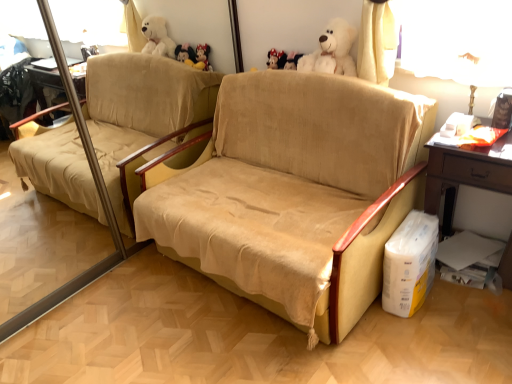
Question: From a real-world perspective, is beige suede couch at center on top of metallic gold table lamp at upper right?

Choices:
 (A) yes
 (B) no

Answer: (B)

Question: Is beige suede couch at center far away from metallic gold table lamp at upper right?

Choices:
 (A) no
 (B) yes

Answer: (A)

Question: Does beige suede couch at center have a greater width compared to metallic gold table lamp at upper right?

Choices:
 (A) no
 (B) yes

Answer: (B)

Question: Is beige suede couch at center behind metallic gold table lamp at upper right?

Choices:
 (A) yes
 (B) no

Answer: (B)

Question: Is beige suede couch at center completely or partially outside of metallic gold table lamp at upper right?

Choices:
 (A) no
 (B) yes

Answer: (B)

Question: In terms of width, does beige suede couch at center look wider or thinner when compared to white cardboard box at lower right?

Choices:
 (A) wide
 (B) thin

Answer: (A)

Question: Would you say beige suede couch at center is to the left or to the right of white cardboard box at lower right in the picture?

Choices:
 (A) right
 (B) left

Answer: (B)

Question: Looking at the image, does beige suede couch at center seem bigger or smaller compared to white cardboard box at lower right?

Choices:
 (A) small
 (B) big

Answer: (B)

Question: From the image's perspective, relative to white cardboard box at lower right, is beige suede couch at center above or below?

Choices:
 (A) below
 (B) above

Answer: (B)

Question: In the image, is fluffy white teddy bear at upper center on the left side or the right side of beige suede couch at center?

Choices:
 (A) left
 (B) right

Answer: (B)

Question: Is fluffy white teddy bear at upper center bigger or smaller than beige suede couch at center?

Choices:
 (A) big
 (B) small

Answer: (B)

Question: Considering the positions of fluffy white teddy bear at upper center and beige suede couch at center in the image, is fluffy white teddy bear at upper center wider or thinner than beige suede couch at center?

Choices:
 (A) wide
 (B) thin

Answer: (B)

Question: From a real-world perspective, is fluffy white teddy bear at upper center above or below beige suede couch at center?

Choices:
 (A) below
 (B) above

Answer: (B)

Question: From a real-world perspective, is wooden table at right positioned above or below white cardboard box at lower right?

Choices:
 (A) below
 (B) above

Answer: (B)

Question: Is wooden table at right in front of or behind white cardboard box at lower right in the image?

Choices:
 (A) front
 (B) behind

Answer: (A)